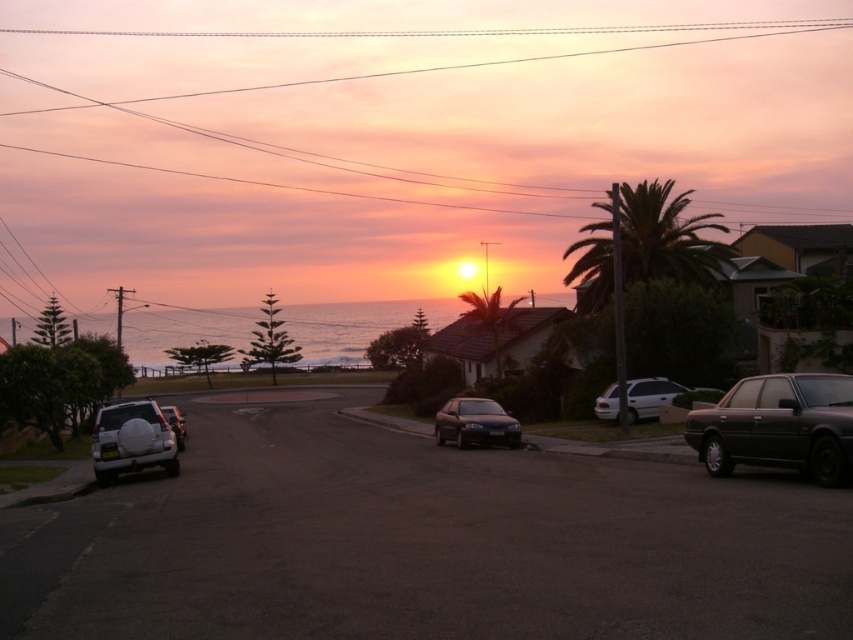
Question: Which object appears farthest from the camera in this image?

Choices:
 (A) metallic silver sedan at center right
 (B) white matte suv at lower left

Answer: (A)

Question: Can you confirm if satin black sedan at center is smaller than green leafy palm tree at center?

Choices:
 (A) yes
 (B) no

Answer: (A)

Question: Is white matte van at center-right positioned before metallic silver suv at center-left?

Choices:
 (A) no
 (B) yes

Answer: (A)

Question: Considering the real-world distances, which object is farthest from the white matte suv at lower left?

Choices:
 (A) green leafy palm tree at center
 (B) white matte van at center-right
 (C) metallic silver suv at center-left
 (D) satin black sedan at center

Answer: (A)

Question: Estimate the real-world distances between objects in this image. Which object is closer to the green leafy palm tree at center-right?

Choices:
 (A) metallic silver sedan at center right
 (B) dark gray metallic sedan at right
 (C) green leafy palm tree at center

Answer: (C)

Question: Is dark gray metallic sedan at right bigger than white matte suv at lower left?

Choices:
 (A) yes
 (B) no

Answer: (A)